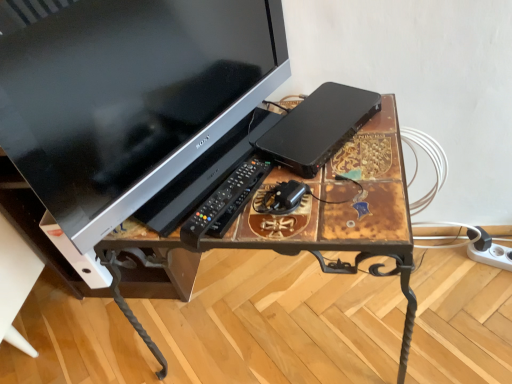
Find the location of a particular element. The width and height of the screenshot is (512, 384). free space behind black plastic power adapter at center is located at coordinates (274, 163).